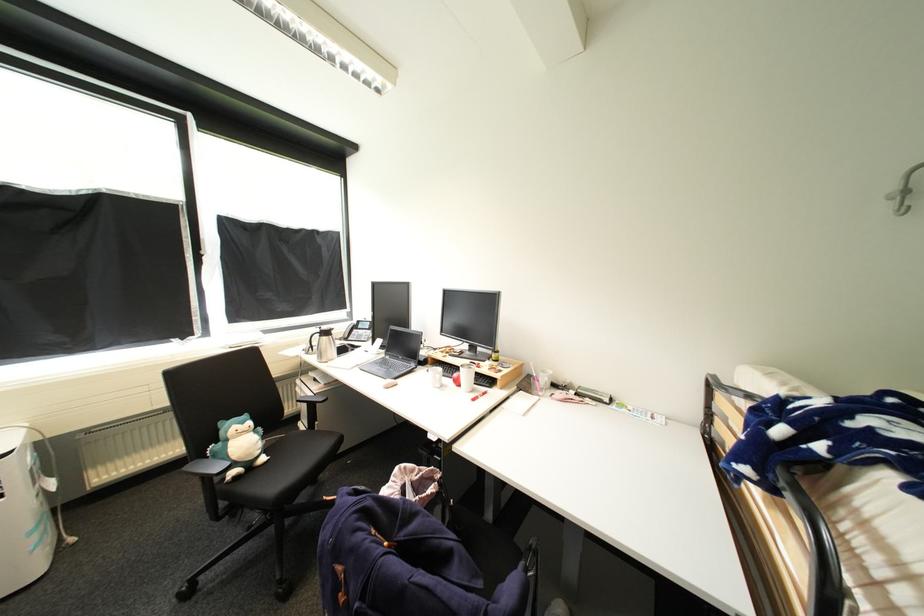
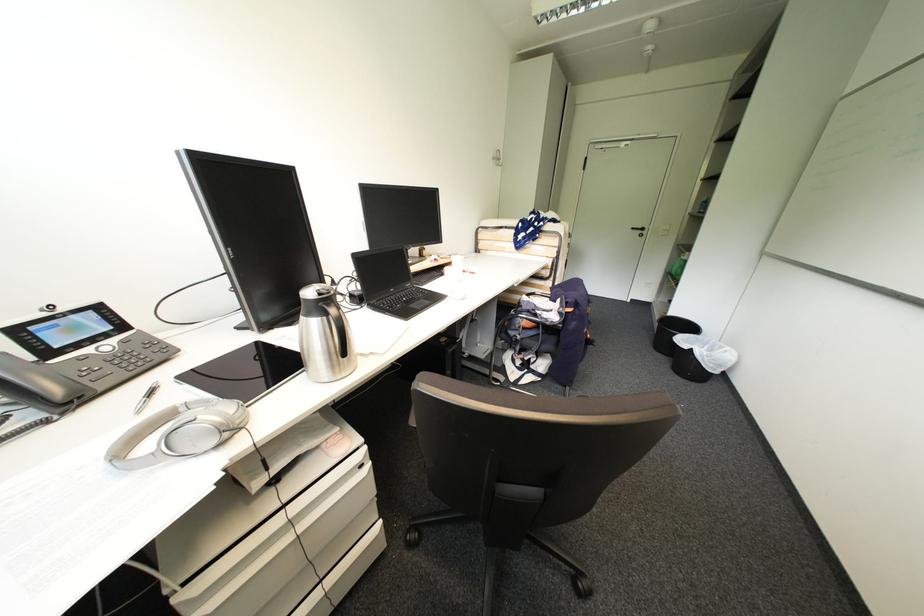
Question: I am providing you with two images of the same scene from different viewpoints. Please identify which objects are invisible in image2.

Choices:
 (A) black trash can
 (B) white door handle
 (C) thermos handle
 (D) none of these

Answer: (D)